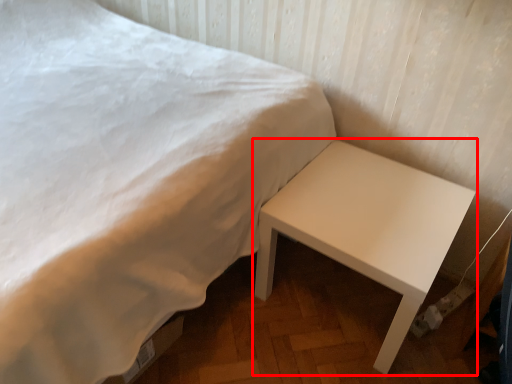
Question: Where is table (annotated by the red box) located in relation to bed in the image?

Choices:
 (A) right
 (B) left

Answer: (A)